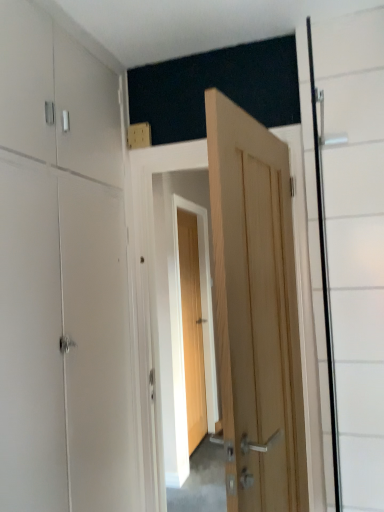
Question: Does point (188, 448) appear closer or farther from the camera than point (311, 224)?

Choices:
 (A) farther
 (B) closer

Answer: (A)

Question: From the image's perspective, is wooden door at center, which appears as the 2th door when viewed from the front, above or below transparent glass door at right?

Choices:
 (A) below
 (B) above

Answer: (A)

Question: Which object is positioned closest to the wooden door at center, which appears as the 2th door when viewed from the front?

Choices:
 (A) transparent glass door at right
 (B) natural wood door at center, acting as the second door starting from the back
 (C) white matte cabinet at left

Answer: (C)

Question: Considering the real-world distances, which object is farthest from the white matte cabinet at left?

Choices:
 (A) wooden door at center, which appears as the 2th door when viewed from the front
 (B) transparent glass door at right
 (C) natural wood door at center, acting as the first door starting from the front

Answer: (A)